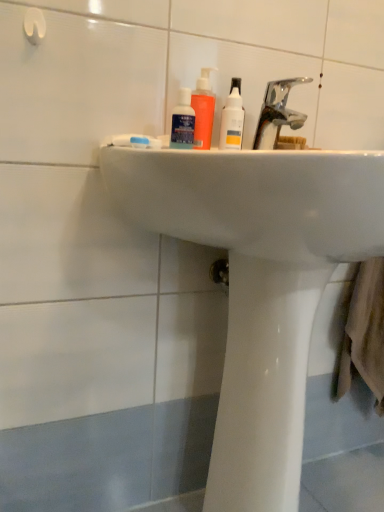
The width and height of the screenshot is (384, 512). Describe the element at coordinates (135, 141) in the screenshot. I see `blue matte toothpaste at center` at that location.

In order to face white glossy bottle at upper center, should I rotate leftwards or rightwards?

Rotate right and turn 5.236 degrees.

This screenshot has height=512, width=384. What are the coordinates of `metallic chrome faucet at upper center` in the screenshot? It's located at (277, 113).

Describe the element at coordinates (264, 384) in the screenshot. The width and height of the screenshot is (384, 512). I see `white glossy bidet at lower center` at that location.

Where is `blue matte toothpaste at center`? blue matte toothpaste at center is located at coordinates coord(135,141).

How many degrees apart are the facing directions of matte black mouthwash at center, which is the 1th mouthwash in front-to-back order, and blue matte toothpaste at center?

They differ by 17 degrees in their facing directions.

From the image's perspective, is matte black mouthwash at center, which is the 1th mouthwash in front-to-back order, below blue matte toothpaste at center?

No.

Which object is positioned more to the left, matte black mouthwash at center, which is the 1th mouthwash in front-to-back order, or blue matte toothpaste at center?

Positioned to the left is blue matte toothpaste at center.

Is matte black mouthwash at center, which ranks as the second mouthwash in back-to-front order, bigger than blue matte toothpaste at center?

Indeed, matte black mouthwash at center, which ranks as the second mouthwash in back-to-front order, has a larger size compared to blue matte toothpaste at center.

Is white glossy sink at center facing away from matte black mouthwash at center, which is the 1th mouthwash in front-to-back order?

white glossy sink at center does not have its back to matte black mouthwash at center, which is the 1th mouthwash in front-to-back order.

Consider the image. Which is behind, white glossy sink at center or matte black mouthwash at center, which ranks as the second mouthwash in back-to-front order?

Positioned behind is matte black mouthwash at center, which ranks as the second mouthwash in back-to-front order.

Is white glossy sink at center thinner than matte black mouthwash at center, which is the 1th mouthwash in front-to-back order?

No, white glossy sink at center is not thinner than matte black mouthwash at center, which is the 1th mouthwash in front-to-back order.

Is white glossy sink at center not near matte black mouthwash at center, which ranks as the second mouthwash in back-to-front order?

white glossy sink at center is actually quite close to matte black mouthwash at center, which ranks as the second mouthwash in back-to-front order.

Looking at this image, how distant is white glossy bottle at upper center from matte black mouthwash at center, which ranks as the second mouthwash in back-to-front order?

white glossy bottle at upper center and matte black mouthwash at center, which ranks as the second mouthwash in back-to-front order, are 7.89 centimeters apart from each other.

Considering the relative positions of white glossy bottle at upper center and matte black mouthwash at center, which is the 1th mouthwash in front-to-back order, in the image provided, is white glossy bottle at upper center behind matte black mouthwash at center, which is the 1th mouthwash in front-to-back order,?

Yes.

Is white glossy bottle at upper center beside matte black mouthwash at center, which ranks as the second mouthwash in back-to-front order?

Yes, white glossy bottle at upper center and matte black mouthwash at center, which ranks as the second mouthwash in back-to-front order, clearly make contact.

Would you say white glossy bidet at lower center contains translucent orange bottle at center, positioned as the second mouthwash in front-to-back order?

That's incorrect, translucent orange bottle at center, positioned as the second mouthwash in front-to-back order, is not inside white glossy bidet at lower center.

From a real-world perspective, is white glossy bidet at lower center physically located above or below translucent orange bottle at center, arranged as the first mouthwash when viewed from the back?

white glossy bidet at lower center is situated lower than translucent orange bottle at center, arranged as the first mouthwash when viewed from the back, in the real world.

From the image's perspective, which one is positioned higher, white glossy bidet at lower center or translucent orange bottle at center, arranged as the first mouthwash when viewed from the back?

translucent orange bottle at center, arranged as the first mouthwash when viewed from the back, from the image's perspective.

The image size is (384, 512). Find the location of `mouthwash that is the 2nd object located behind the white glossy bidet at lower center`. mouthwash that is the 2nd object located behind the white glossy bidet at lower center is located at coordinates (203, 110).

Considering the relative sizes of blue matte toothpaste at center and white glossy bottle at upper center in the image provided, is blue matte toothpaste at center thinner than white glossy bottle at upper center?

Indeed, blue matte toothpaste at center has a lesser width compared to white glossy bottle at upper center.

Can you confirm if blue matte toothpaste at center is smaller than white glossy bottle at upper center?

Indeed, blue matte toothpaste at center has a smaller size compared to white glossy bottle at upper center.

Are blue matte toothpaste at center and white glossy bottle at upper center making contact?

No, blue matte toothpaste at center is not making contact with white glossy bottle at upper center.

The width and height of the screenshot is (384, 512). In order to click on cleaning product above the blue matte toothpaste at center (from the image's perspective) in this screenshot , I will do `click(232, 118)`.

From the image's perspective, is blue matte toothpaste at center beneath translucent orange bottle at center, positioned as the second mouthwash in front-to-back order?

Yes, from the image's perspective, blue matte toothpaste at center is beneath translucent orange bottle at center, positioned as the second mouthwash in front-to-back order.

Is blue matte toothpaste at center located outside translucent orange bottle at center, arranged as the first mouthwash when viewed from the back?

Yes, blue matte toothpaste at center is located beyond the bounds of translucent orange bottle at center, arranged as the first mouthwash when viewed from the back.

Can you confirm if blue matte toothpaste at center is thinner than translucent orange bottle at center, arranged as the first mouthwash when viewed from the back?

Yes.

Can you confirm if blue matte toothpaste at center is positioned to the left of translucent orange bottle at center, positioned as the second mouthwash in front-to-back order?

Yes, blue matte toothpaste at center is to the left of translucent orange bottle at center, positioned as the second mouthwash in front-to-back order.

Which object is wider, blue matte toothpaste at center or white glossy sink at center?

With larger width is white glossy sink at center.

Between blue matte toothpaste at center and white glossy sink at center, which one is positioned in front?

Positioned in front is white glossy sink at center.

Where is `toothpaste on the left of the white glossy sink at center`? This screenshot has height=512, width=384. toothpaste on the left of the white glossy sink at center is located at coordinates (135, 141).

From their relative heights in the image, would you say blue matte toothpaste at center is taller or shorter than white glossy sink at center?

Clearly, blue matte toothpaste at center is shorter compared to white glossy sink at center.

You are a GUI agent. You are given a task and a screenshot of the screen. Output one action in this format:
    pyautogui.click(x=<x>, y=<y>)
    Task: Click on the 1st mouthwash behind the blue matte toothpaste at center, starting your count from the anchor
    The height and width of the screenshot is (512, 384).
    Given the screenshot: What is the action you would take?
    pyautogui.click(x=183, y=122)

Image resolution: width=384 pixels, height=512 pixels. Find the location of `sink located in front of the matte black mouthwash at center, which is the 1th mouthwash in front-to-back order`. sink located in front of the matte black mouthwash at center, which is the 1th mouthwash in front-to-back order is located at coordinates (255, 200).

Estimate the real-world distances between objects in this image. Which object is further from blue matte toothpaste at center, matte black mouthwash at center, which is the 1th mouthwash in front-to-back order, or white glossy bottle at upper center?

Among the two, white glossy bottle at upper center is located further to blue matte toothpaste at center.

Looking at the image, which one is located further to translucent orange bottle at center, positioned as the second mouthwash in front-to-back order, matte black mouthwash at center, which ranks as the second mouthwash in back-to-front order, or metallic chrome faucet at upper center?

metallic chrome faucet at upper center.

From the picture: Which object lies nearer to the anchor point blue matte toothpaste at center, translucent orange bottle at center, arranged as the first mouthwash when viewed from the back, or white glossy sink at center?

Among the two, translucent orange bottle at center, arranged as the first mouthwash when viewed from the back, is located nearer to blue matte toothpaste at center.

Based on their spatial positions, is matte black mouthwash at center, which is the 1th mouthwash in front-to-back order, or white glossy bottle at upper center further from translucent orange bottle at center, arranged as the first mouthwash when viewed from the back?

white glossy bottle at upper center is positioned further to the anchor translucent orange bottle at center, arranged as the first mouthwash when viewed from the back.

Considering their positions, is white glossy bottle at upper center positioned closer to blue matte toothpaste at center than matte black mouthwash at center, which ranks as the second mouthwash in back-to-front order?

Among the two, matte black mouthwash at center, which ranks as the second mouthwash in back-to-front order, is located nearer to blue matte toothpaste at center.

Looking at the image, which one is located further to white glossy bottle at upper center, metallic chrome faucet at upper center or blue matte toothpaste at center?

Based on the image, blue matte toothpaste at center appears to be further to white glossy bottle at upper center.

Considering their positions, is white glossy bottle at upper center positioned closer to white glossy bidet at lower center than metallic chrome faucet at upper center?

white glossy bottle at upper center is closer to white glossy bidet at lower center.

Considering their positions, is white glossy bidet at lower center positioned further to translucent orange bottle at center, arranged as the first mouthwash when viewed from the back, than white glossy bottle at upper center?

Based on the image, white glossy bidet at lower center appears to be further to translucent orange bottle at center, arranged as the first mouthwash when viewed from the back.

Find the location of a particular element. This screenshot has height=512, width=384. sink between translucent orange bottle at center, positioned as the second mouthwash in front-to-back order, and white glossy bidet at lower center from top to bottom is located at coordinates (255, 200).

You are a GUI agent. You are given a task and a screenshot of the screen. Output one action in this format:
    pyautogui.click(x=<x>, y=<y>)
    Task: Click on the toothpaste between white glossy sink at center and translucent orange bottle at center, positioned as the second mouthwash in front-to-back order, from front to back
    
    Given the screenshot: What is the action you would take?
    pyautogui.click(x=135, y=141)

You are a GUI agent. You are given a task and a screenshot of the screen. Output one action in this format:
    pyautogui.click(x=<x>, y=<y>)
    Task: Click on the toothpaste between metallic chrome faucet at upper center and white glossy bidet at lower center in the vertical direction
    
    Given the screenshot: What is the action you would take?
    pyautogui.click(x=135, y=141)

At what (x,y) coordinates should I click in order to perform the action: click on mouthwash that lies between metallic chrome faucet at upper center and white glossy bidet at lower center from top to bottom. Please return your answer as a coordinate pair (x, y). Looking at the image, I should click on (183, 122).